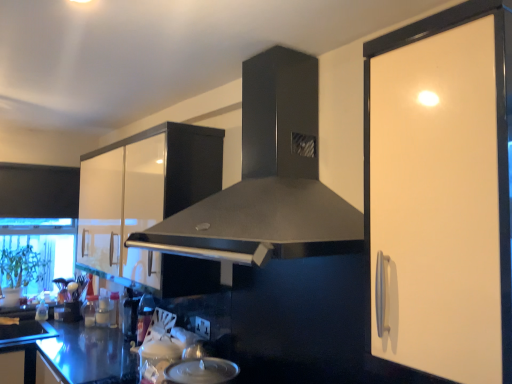
Question: Does transparent glass window screen at lower left have a lesser width compared to shiny metallic bottle at lower left, which is the first appliance in front-to-back order?

Choices:
 (A) yes
 (B) no

Answer: (B)

Question: From the image's perspective, is transparent glass window screen at lower left on shiny metallic bottle at lower left, which is the first appliance in front-to-back order?

Choices:
 (A) yes
 (B) no

Answer: (A)

Question: Can you confirm if transparent glass window screen at lower left is wider than shiny metallic bottle at lower left, marked as the second appliance in a back-to-front arrangement?

Choices:
 (A) yes
 (B) no

Answer: (A)

Question: Considering the relative sizes of transparent glass window screen at lower left and shiny metallic bottle at lower left, which is the first appliance in front-to-back order, in the image provided, is transparent glass window screen at lower left taller than shiny metallic bottle at lower left, which is the first appliance in front-to-back order,?

Choices:
 (A) yes
 (B) no

Answer: (A)

Question: Is the position of transparent glass window screen at lower left more distant than that of shiny metallic bottle at lower left, which is the 2th appliance from left to right?

Choices:
 (A) no
 (B) yes

Answer: (B)

Question: From a real-world perspective, is white glossy cabinet handle at right above or below glossy white cabinet at upper left?

Choices:
 (A) above
 (B) below

Answer: (B)

Question: Is point (403, 291) positioned closer to the camera than point (206, 137)?

Choices:
 (A) closer
 (B) farther

Answer: (A)

Question: Considering their positions, is white glossy cabinet handle at right located in front of or behind glossy white cabinet at upper left?

Choices:
 (A) behind
 (B) front

Answer: (B)

Question: Looking at the image, does white glossy cabinet handle at right seem bigger or smaller compared to glossy white cabinet at upper left?

Choices:
 (A) small
 (B) big

Answer: (A)

Question: Is matte black knife block at lower left, arranged as the second appliance when viewed from the front, wider or thinner than white glossy cabinet handle at right?

Choices:
 (A) wide
 (B) thin

Answer: (B)

Question: Is point (73, 314) closer or farther from the camera than point (374, 114)?

Choices:
 (A) closer
 (B) farther

Answer: (B)

Question: From a real-world perspective, is matte black knife block at lower left, arranged as the first appliance when viewed from the left, positioned above or below white glossy cabinet handle at right?

Choices:
 (A) below
 (B) above

Answer: (A)

Question: Considering their positions, is matte black knife block at lower left, arranged as the first appliance when viewed from the left, located in front of or behind white glossy cabinet handle at right?

Choices:
 (A) front
 (B) behind

Answer: (B)

Question: Looking at their shapes, would you say matte black range hood at center is wider or thinner than matte black knife block at lower left, arranged as the first appliance when viewed from the left?

Choices:
 (A) wide
 (B) thin

Answer: (A)

Question: Based on their positions, is matte black range hood at center located to the left or right of matte black knife block at lower left, the second appliance positioned from the right?

Choices:
 (A) right
 (B) left

Answer: (A)